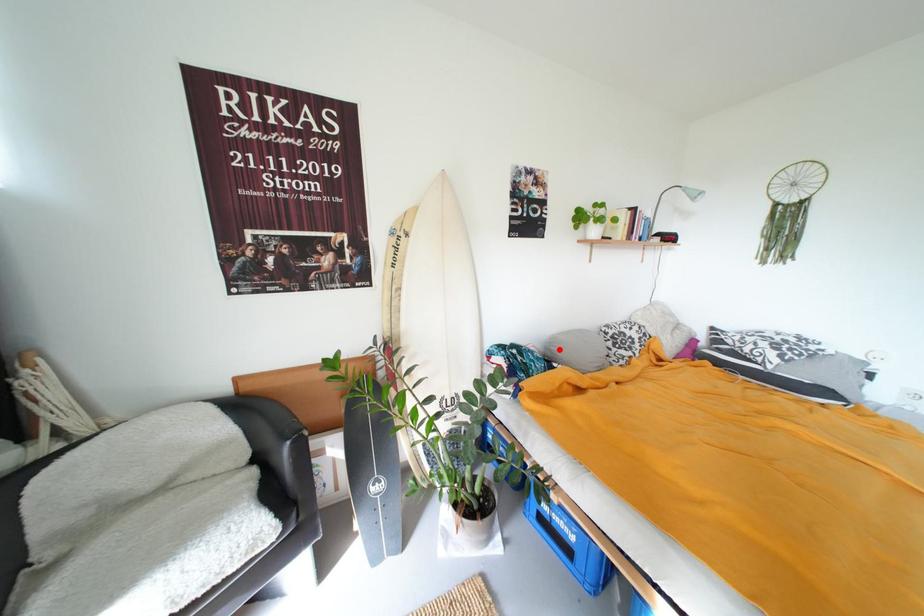
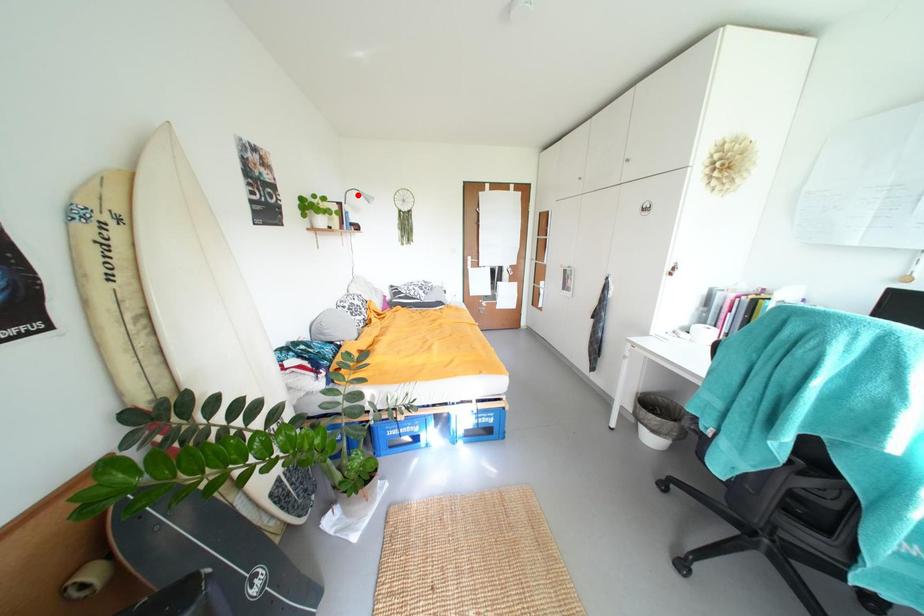
I am providing you with two images of the same scene from different viewpoints. A red point is marked on the first image and another point is marked on the second image. Do the highlighted points in image1 and image2 indicate the same real-world spot?

No